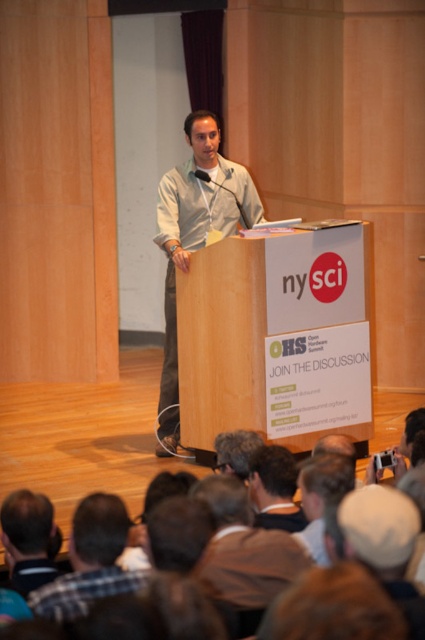
Question: Does brown fabric crowd at lower center have a smaller size compared to light gray cotton shirt at center?

Choices:
 (A) no
 (B) yes

Answer: (A)

Question: Is light gray cotton shirt at center wider than plaid fabric shirt at lower left?

Choices:
 (A) yes
 (B) no

Answer: (A)

Question: Which point is closer to the camera taking this photo?

Choices:
 (A) (113, 595)
 (B) (107, 438)

Answer: (A)

Question: Estimate the real-world distances between objects in this image. Which object is farther from the light gray cotton shirt at center?

Choices:
 (A) plaid fabric shirt at lower left
 (B) brown fabric crowd at lower center

Answer: (A)

Question: Can you confirm if light gray cotton shirt at center is positioned below plaid fabric shirt at lower left?

Choices:
 (A) no
 (B) yes

Answer: (A)

Question: Among these points, which one is farthest from the camera?

Choices:
 (A) (115, 560)
 (B) (169, 346)

Answer: (B)